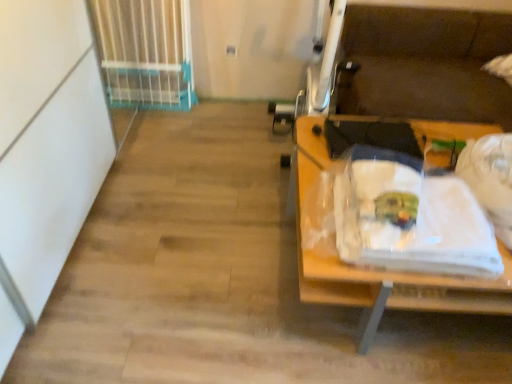
The height and width of the screenshot is (384, 512). Identify the location of blank area beneath white plastic gate at upper left (from a real-world perspective). (147, 101).